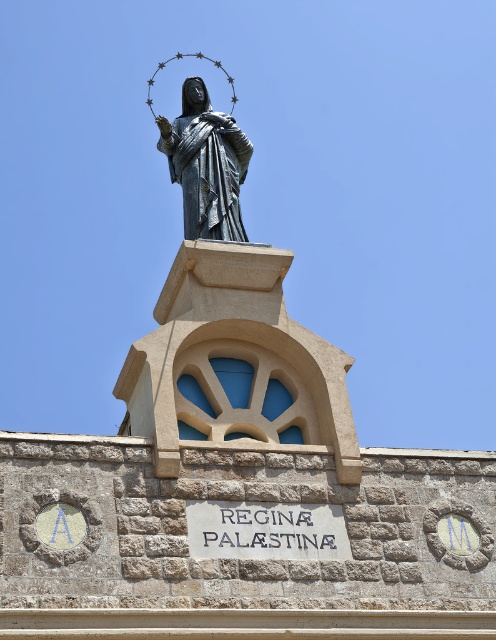
Is polished bronze statue at center wider than white stone sign at center?

Yes, polished bronze statue at center is wider than white stone sign at center.

Based on the photo, who is positioned more to the right, polished bronze statue at center or white stone sign at center?

From the viewer's perspective, white stone sign at center appears more on the right side.

Which is in front, point (227, 132) or point (197, 544)?

Point (197, 544) is in front.

The image size is (496, 640). I want to click on polished bronze statue at center, so (x=205, y=164).